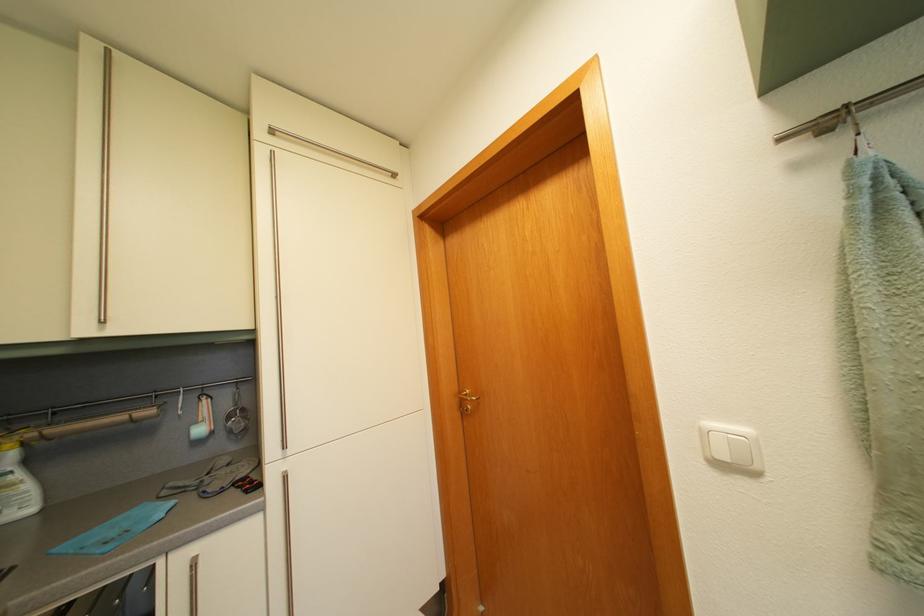
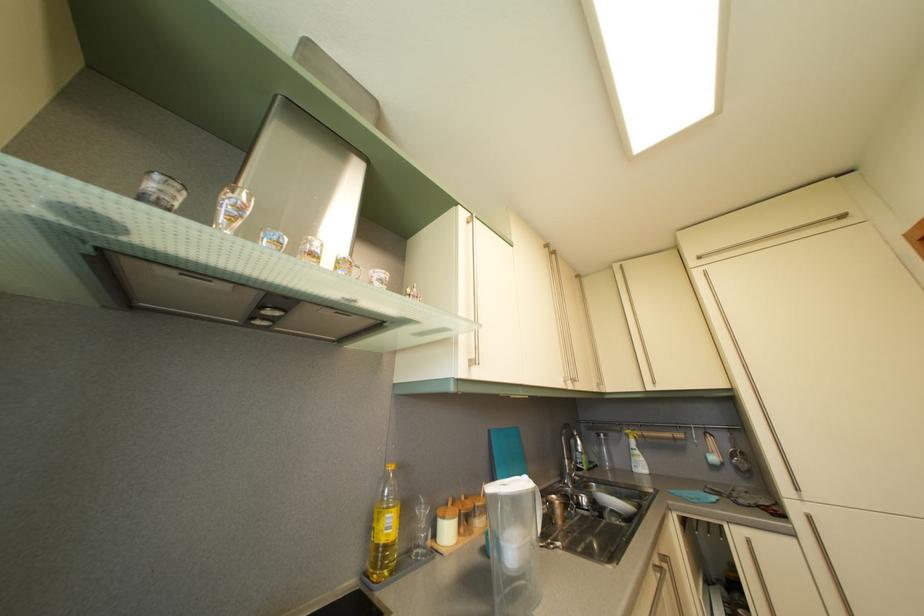
Find the pixel in the second image that matches the point at 99,52 in the first image.

(624, 274)